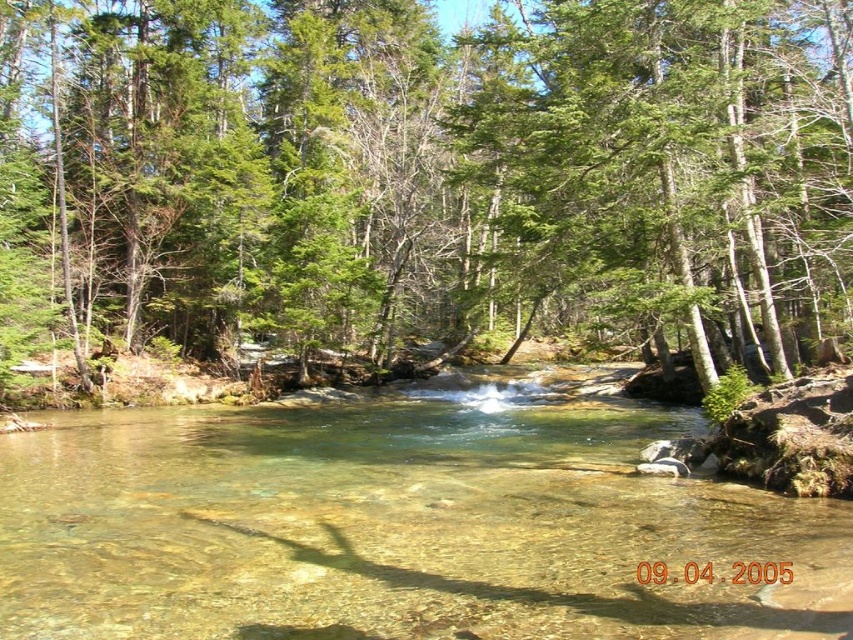
You are standing at the edge of the forest stream and want to take a photo of both the point at coordinates (541, 230) and the point at (460, 600) in the image. Which point will appear closer to the camera in your photo?

Point (460, 600) will appear closer to the camera in the photo because it is physically closer to the camera than point (541, 230), which is further away.

You are planning to set up a picnic blanket in the forest scene. The picnic blanket is 2 meters wide. You see the green leafy tree at center and the clear glass river at center. Which object is wider, and can you place your blanket between them without it overlapping either?

The green leafy tree at center is wider than the clear glass river at center. Since the blanket is 2 meters wide, you need to check the distance between them. However, the description only states the tree is wider, not the distance between them. Without knowing the space between, it is uncertain if the blanket will fit without overlapping.